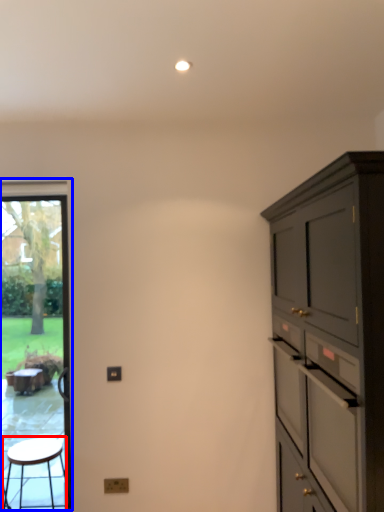
Question: Among these objects, which one is farthest to the camera, stool (highlighted by a red box) or window screen (highlighted by a blue box)?

Choices:
 (A) stool
 (B) window screen

Answer: (B)